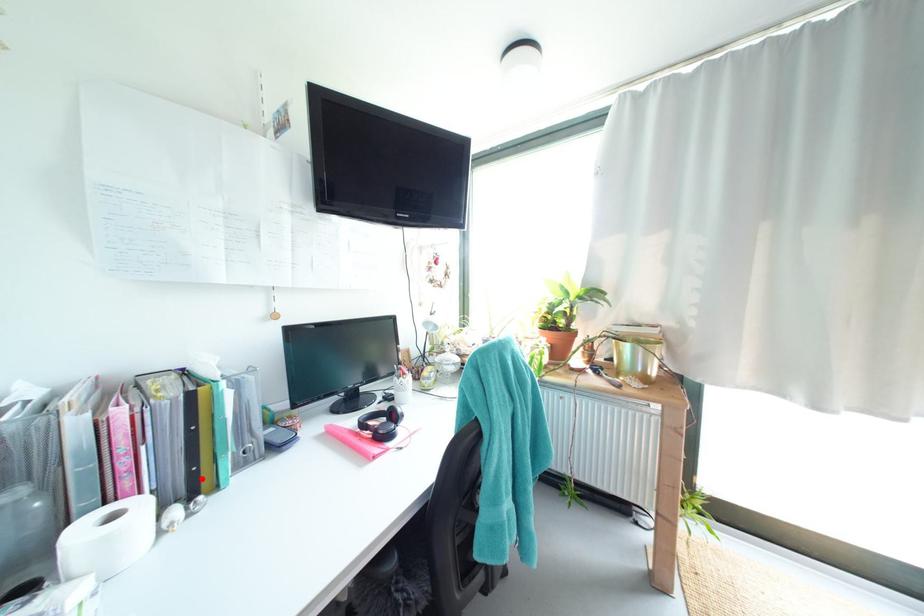
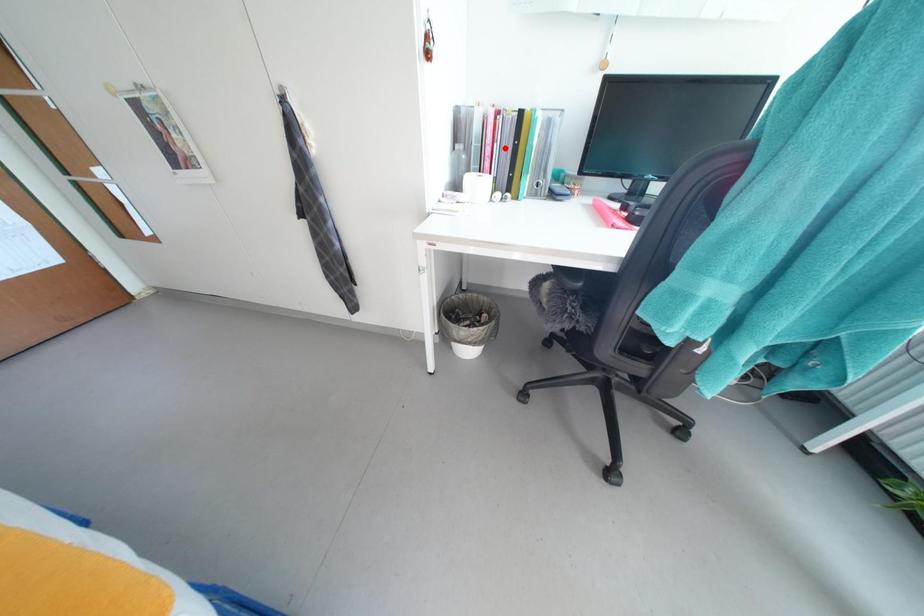
I am providing you with two images of the same scene from different viewpoints. A red point is marked on the first image and another point is marked on the second image. Are the points marked in image1 and image2 representing the same 3D position?

No